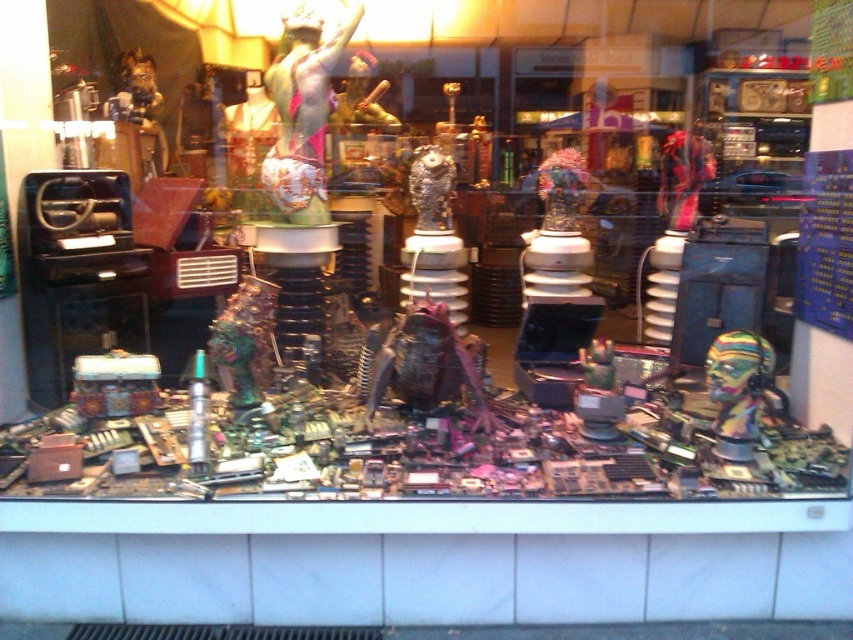
You are a delivery person who needs to place a new box that is 1 meter in height onto the available space between the metallic green statue at center and the multicolored plastic head at center. Can the box fit there?

The metallic green statue at center is larger than the multicolored plastic head at center, so the space between them may be sufficient to accommodate a box of 1 meter in height. However, without exact measurements of the gap, it is uncertain. Please check the actual distance between them.

You are standing in front of the store window and want to touch both the point at coordinates point (318, 124) and point (770, 401). Which point should you reach for first to touch the closer one?

You should reach for point (318, 124) first because it is closer to you than point (770, 401).